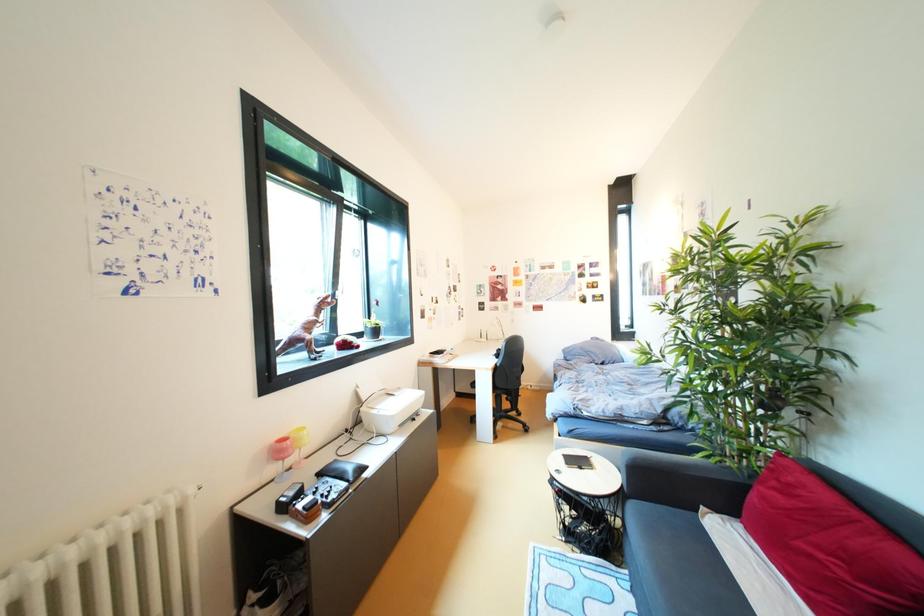
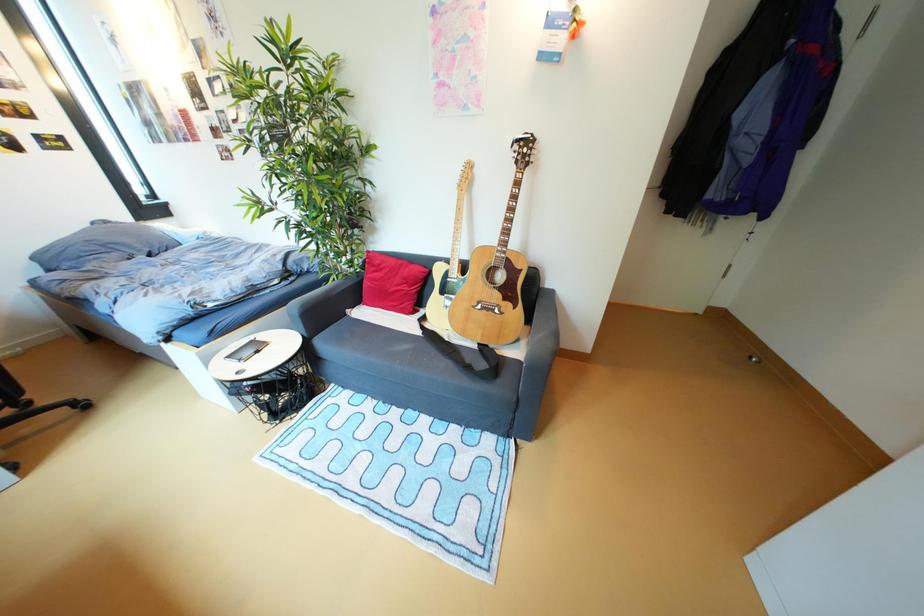
The first image is from the beginning of the video and the second image is from the end. How did the camera likely rotate when shooting the video?

The camera rotated toward right-down.